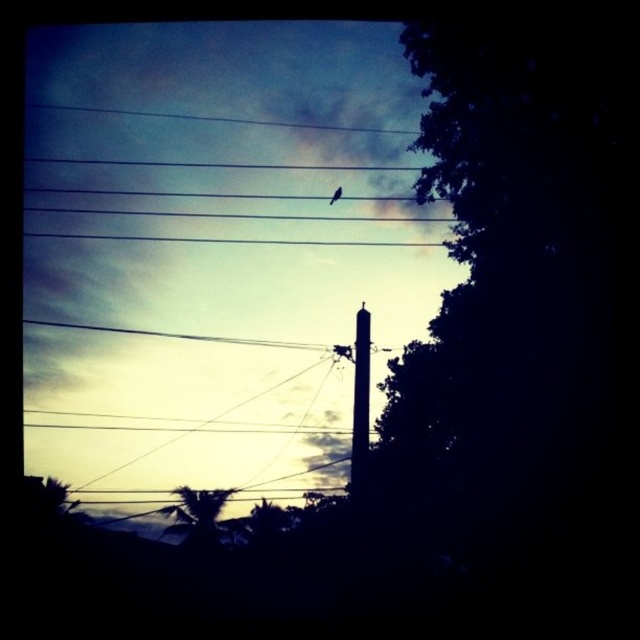
Is dark green leafy tree at right smaller than green leafy tree at lower left?

Incorrect, dark green leafy tree at right is not smaller in size than green leafy tree at lower left.

Which of these two, dark green leafy tree at right or green leafy tree at lower left, stands taller?

dark green leafy tree at right

Measure the distance between point (x=488, y=74) and camera.

They are 46.78 feet apart.

At what (x,y) coordinates should I click in order to perform the action: click on dark green leafy tree at right. Please return your answer as a coordinate pair (x, y). Looking at the image, I should click on (508, 284).

Does dark green leafy tree at right have a greater width compared to smooth concrete pole at center?

Yes.

The image size is (640, 640). Find the location of `dark green leafy tree at right`. dark green leafy tree at right is located at coordinates (508, 284).

Does point (512, 477) lie behind point (369, 344)?

No, it is not.

Image resolution: width=640 pixels, height=640 pixels. What are the coordinates of `dark green leafy tree at right` in the screenshot? It's located at (508, 284).

Who is more forward, (182, 492) or (332, 198)?

Positioned in front is point (332, 198).

Measure the distance between point (x=208, y=532) and camera.

They are 141.31 feet apart.

In order to click on green leafy tree at lower left in this screenshot , I will do `click(196, 515)`.